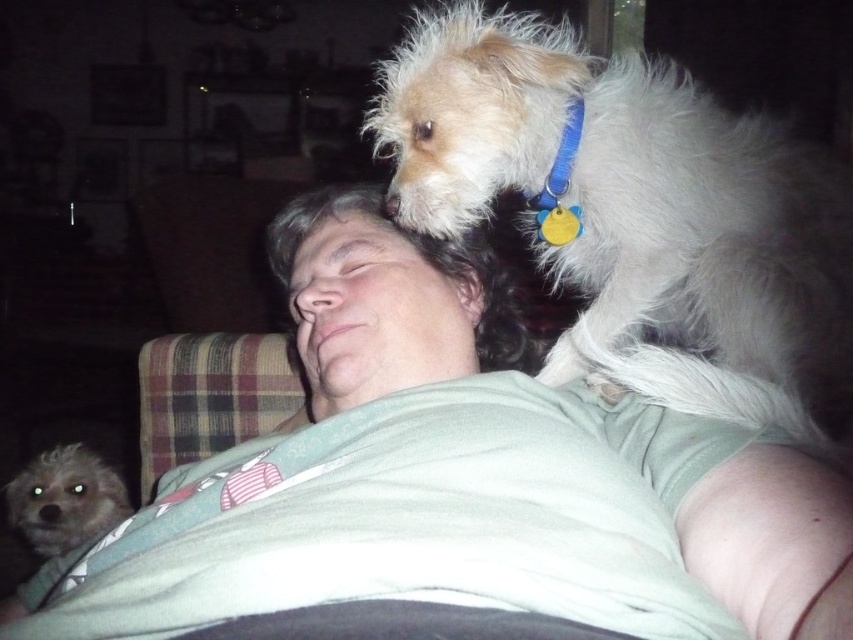
Between point (440, 33) and point (383, 310), which one is positioned in front?

Point (383, 310) is more forward.

Who is positioned more to the right, fluffy white dog at upper right or white fluffy dog at upper center?

fluffy white dog at upper right

Between point (606, 240) and point (357, 275), which one is positioned behind?

Positioned behind is point (357, 275).

You are a GUI agent. You are given a task and a screenshot of the screen. Output one action in this format:
    pyautogui.click(x=<x>, y=<y>)
    Task: Click on the fluffy white dog at upper right
    
    Given the screenshot: What is the action you would take?
    pyautogui.click(x=636, y=212)

Is the position of shaggy gray dog at lower left more distant than that of blue fabric neckband at upper center?

That is True.

Can you confirm if shaggy gray dog at lower left is bigger than blue fabric neckband at upper center?

Correct, shaggy gray dog at lower left is larger in size than blue fabric neckband at upper center.

What do you see at coordinates (64, 499) in the screenshot?
I see `shaggy gray dog at lower left` at bounding box center [64, 499].

This screenshot has height=640, width=853. What are the coordinates of `shaggy gray dog at lower left` in the screenshot? It's located at (64, 499).

Identify the location of white fluffy dog at upper center. (384, 300).

Between point (421, 276) and point (578, 134), which one is positioned behind?

The point (421, 276) is more distant.

This screenshot has height=640, width=853. Identify the location of white fluffy dog at upper center. (384, 300).